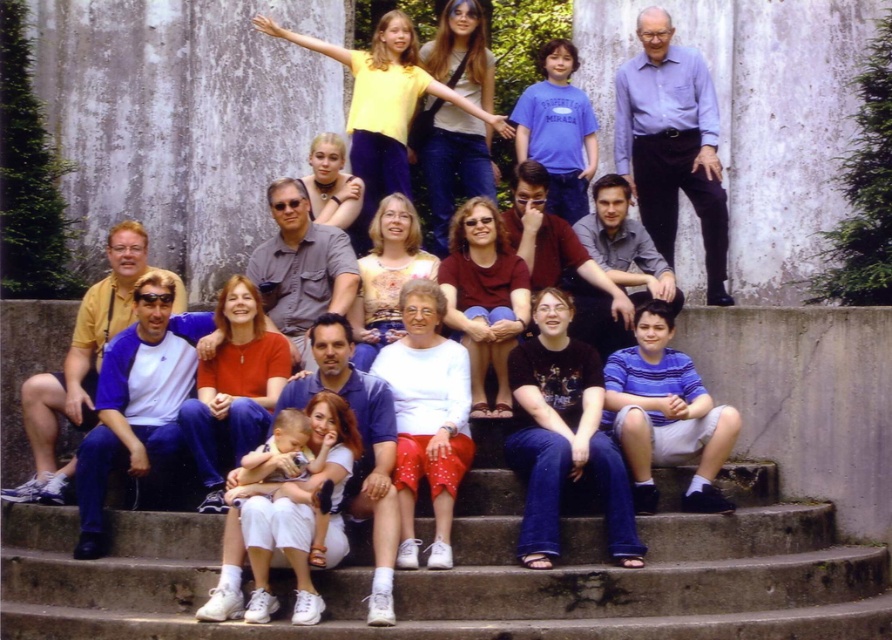
Question: Does concrete stairs at lower center have a greater width compared to blue jersey at lower left?

Choices:
 (A) yes
 (B) no

Answer: (A)

Question: Does white cotton shirt at center have a larger size compared to denim shirt at center?

Choices:
 (A) no
 (B) yes

Answer: (A)

Question: Which object appears farthest from the camera in this image?

Choices:
 (A) blue jersey at lower left
 (B) concrete stairs at lower center
 (C) white cotton shirt at center
 (D) blue shirt at upper right

Answer: (D)

Question: Which point is closer to the camera?

Choices:
 (A) (684, 186)
 (B) (818, 563)

Answer: (B)

Question: Which point appears farthest from the camera in this image?

Choices:
 (A) (246, 474)
 (B) (723, 218)
 (C) (675, 579)
 (D) (282, 272)

Answer: (B)

Question: Is blue shirt at upper right thinner than denim shirt at center?

Choices:
 (A) no
 (B) yes

Answer: (A)